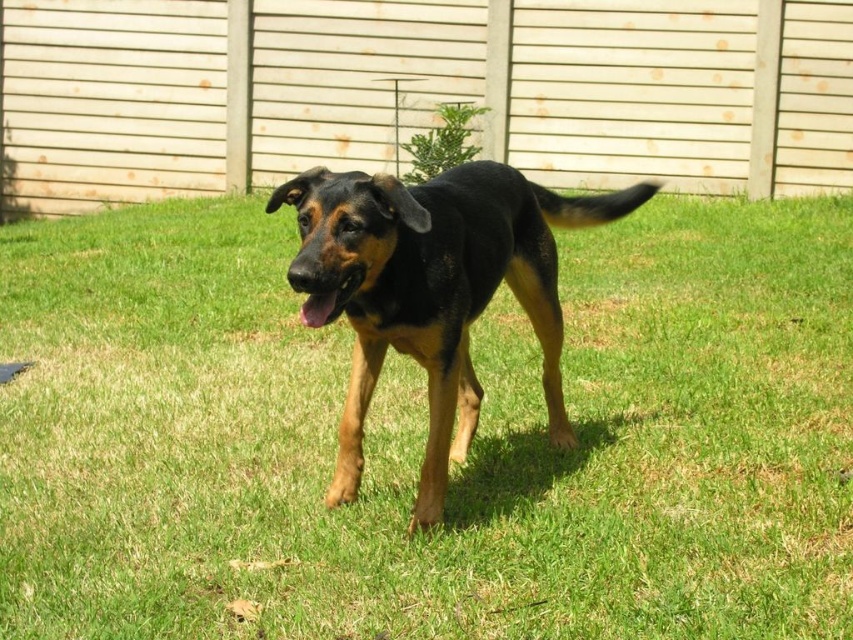
Is green grass at center thinner than black smooth dog at center?

Yes, green grass at center is thinner than black smooth dog at center.

Is green grass at center closer to camera compared to black smooth dog at center?

No, it is not.

Identify the location of green grass at center. (422, 438).

The width and height of the screenshot is (853, 640). What are the coordinates of `green grass at center` in the screenshot? It's located at (422, 438).